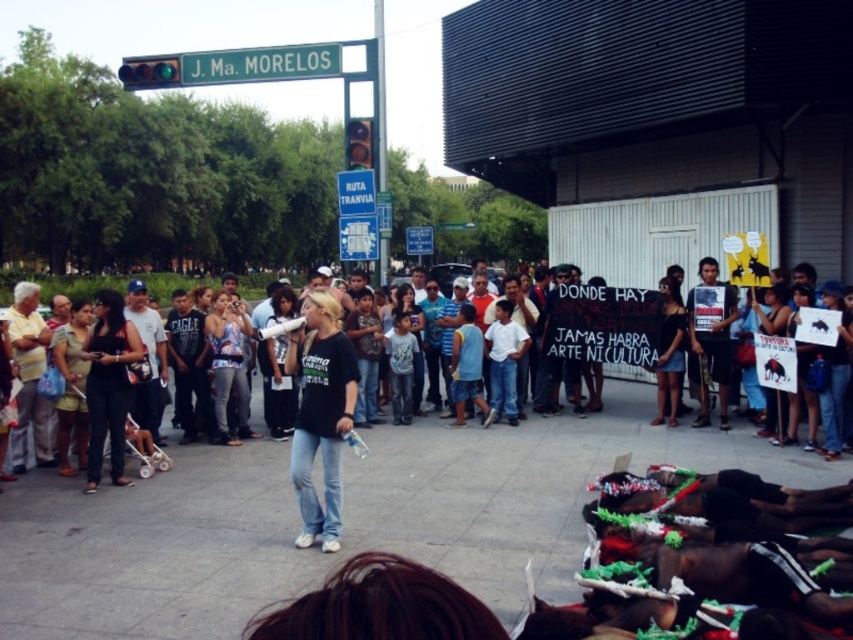
You are a photographer trying to capture a photo of the protest scene. You want to ensure both the green metallic street sign at upper left and the black fabric shirt at center are visible in the frame. Based on their sizes, which object should appear larger in your photo?

The green metallic street sign at upper left is taller than the black fabric shirt at center, so it should appear larger in the photo.

You are a photographer standing at the center of the plaza. You want to take a photo that includes both the point at coordinates point [325,54] and point [132,344]. Which point should you focus on first to ensure both are in focus?

You should focus on point [325,54] first because it is closer to the camera than point [132,344]. Since it is closer, focusing on it will ensure the farther point is also in focus within the depth of field.